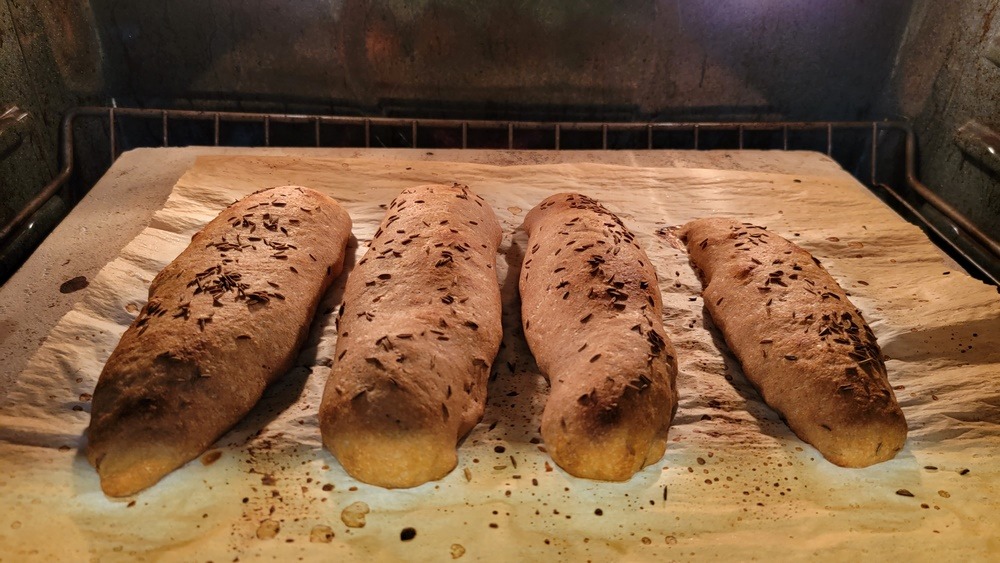
You are a GUI agent. You are given a task and a screenshot of the screen. Output one action in this format:
    pyautogui.click(x=<x>, y=<y>)
    Task: Click on the oven walls
    Image resolution: width=1000 pixels, height=563 pixels.
    Given the screenshot: What is the action you would take?
    pyautogui.click(x=295, y=43), pyautogui.click(x=35, y=95), pyautogui.click(x=964, y=101)